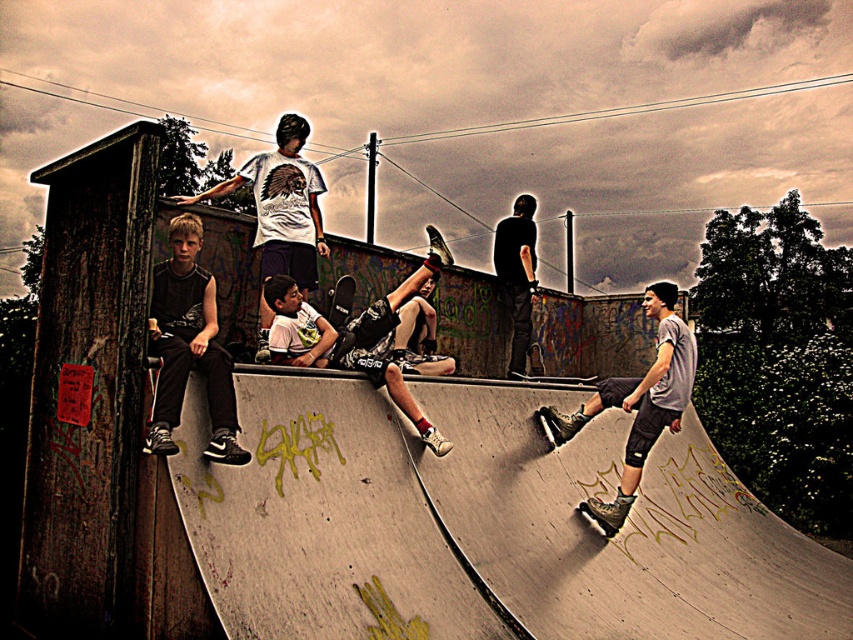
Question: Is black matte pants at left smaller than dark gray pants at center?

Choices:
 (A) yes
 (B) no

Answer: (B)

Question: Which is nearer to the black matte pants at left?

Choices:
 (A) matte gray shorts at center
 (B) dark gray pants at center

Answer: (A)

Question: Does white matte t-shirt at upper center have a greater width compared to dark gray pants at center?

Choices:
 (A) no
 (B) yes

Answer: (B)

Question: Among these objects, which one is farthest from the camera?

Choices:
 (A) white matte t-shirt at upper center
 (B) dark gray pants at center
 (C) black matte pants at left
 (D) matte gray shorts at center

Answer: (B)

Question: Which of the following is the closest to the observer?

Choices:
 (A) black matte pants at left
 (B) dark gray pants at center
 (C) white matte t-shirt at upper center
 (D) matte gray shorts at center

Answer: (A)

Question: Can you confirm if black matte pants at left is smaller than dark gray pants at center?

Choices:
 (A) no
 (B) yes

Answer: (A)